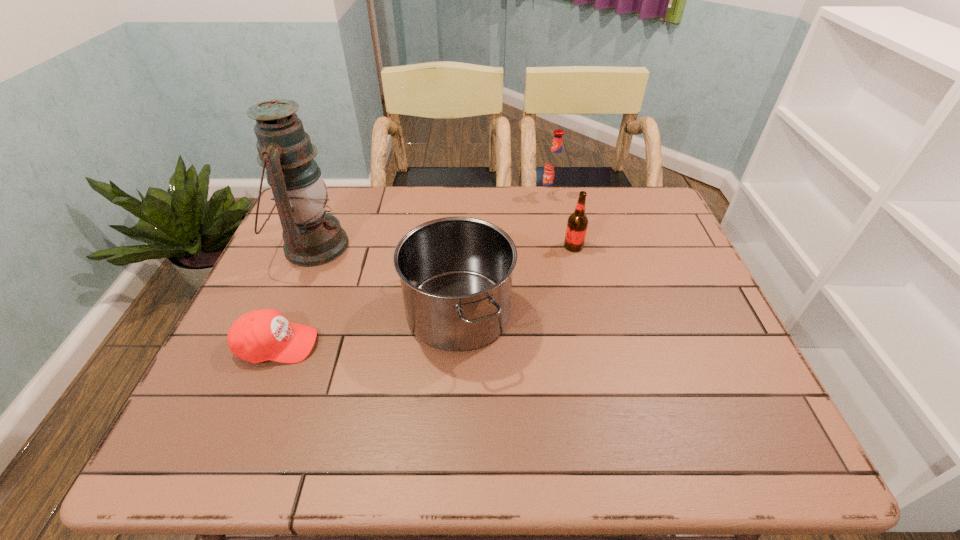
This screenshot has width=960, height=540. What are the coordinates of `oil lamp` in the screenshot? It's located at (312, 237).

At what (x,y) coordinates should I click in order to perform the action: click on the taller root beer. Please return your answer as a coordinate pair (x, y). The height and width of the screenshot is (540, 960). Looking at the image, I should click on (554, 167).

What are the coordinates of `the farther root beer` in the screenshot? It's located at (554, 167).

Find the location of a particular element. saucepan is located at coordinates (456, 272).

The height and width of the screenshot is (540, 960). In order to click on the shorter root beer in this screenshot , I will do `click(577, 224)`.

The width and height of the screenshot is (960, 540). I want to click on baseball cap, so click(260, 335).

Locate an element on the screen. free space located on the back of the tallest object is located at coordinates (337, 190).

You are a GUI agent. You are given a task and a screenshot of the screen. Output one action in this format:
    pyautogui.click(x=<x>, y=<y>)
    Task: Click on the vacant space situated 0.150m on the right of the taller root beer
    Image resolution: width=960 pixels, height=540 pixels.
    Given the screenshot: What is the action you would take?
    pyautogui.click(x=607, y=197)

What are the coordinates of `vacant space located 0.180m on the front of the third object from left to right` in the screenshot? It's located at (452, 453).

In order to click on vacant space situated on the left of the nearer root beer in this screenshot , I will do `click(525, 246)`.